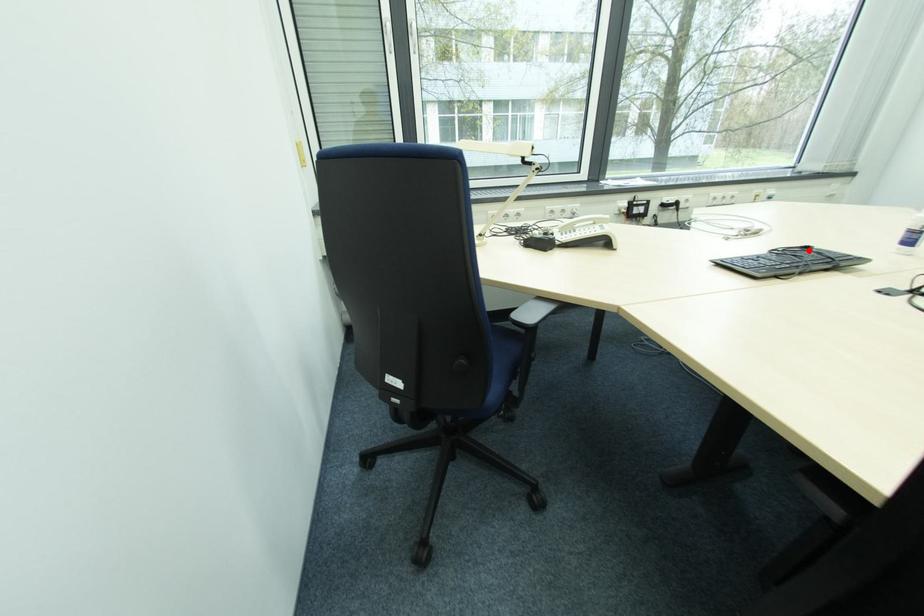
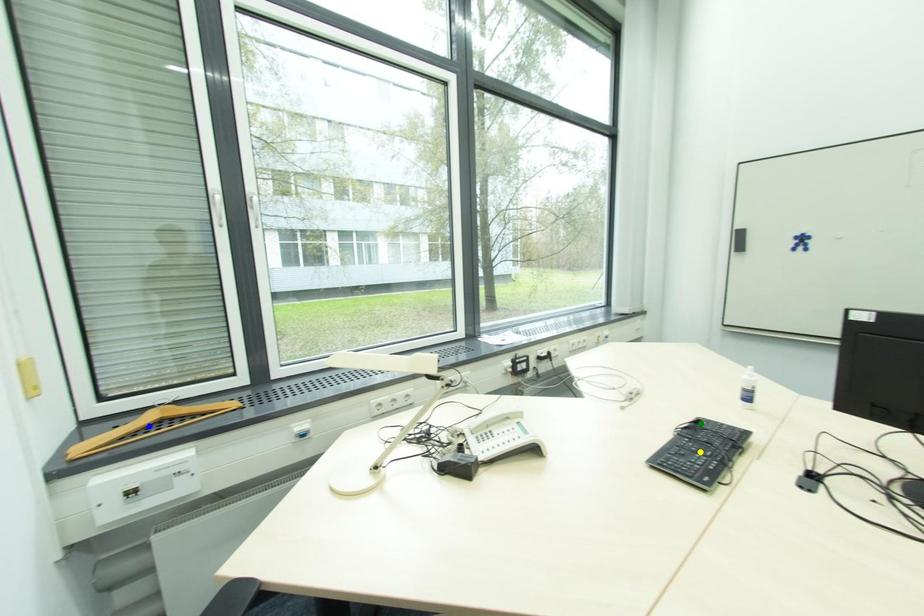
Question: I am providing you with two images of the same scene from different viewpoints. A red point is marked on the first image. You are given multiple points on the second image. Which point in image 2 is actually the same real-world point as the red point in image 1?

Choices:
 (A) blue point
 (B) yellow point
 (C) green point

Answer: (C)